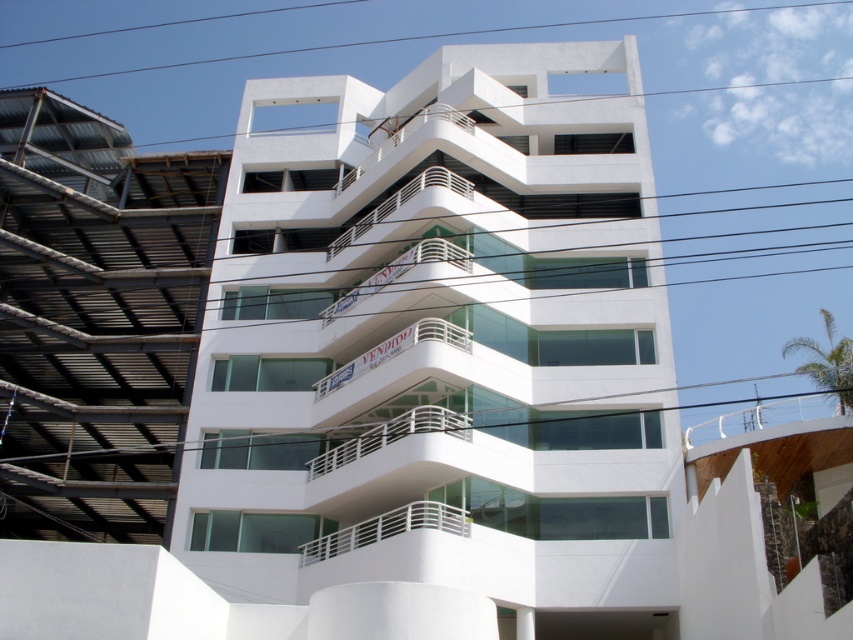
Can you confirm if white glass balcony at center is bigger than white metal railing at center?

Correct, white glass balcony at center is larger in size than white metal railing at center.

Between white glass balcony at center and white metal railing at center, which one is positioned lower?

Positioned lower is white metal railing at center.

Which is behind, point (285, 336) or point (427, 525)?

Point (285, 336)

This screenshot has height=640, width=853. I want to click on white glass balcony at center, so click(x=439, y=339).